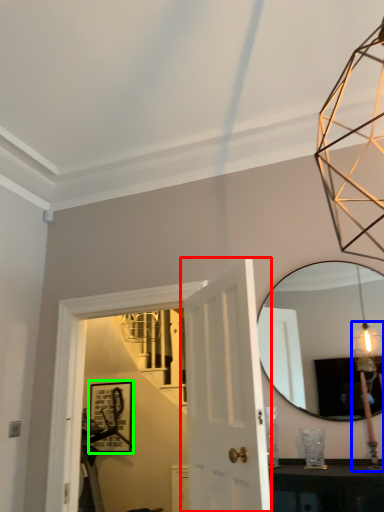
Question: Considering the real-world distances, which object is closest to door (highlighted by a red box)? light fixture (highlighted by a blue box) or picture frame (highlighted by a green box).

Choices:
 (A) light fixture
 (B) picture frame

Answer: (A)